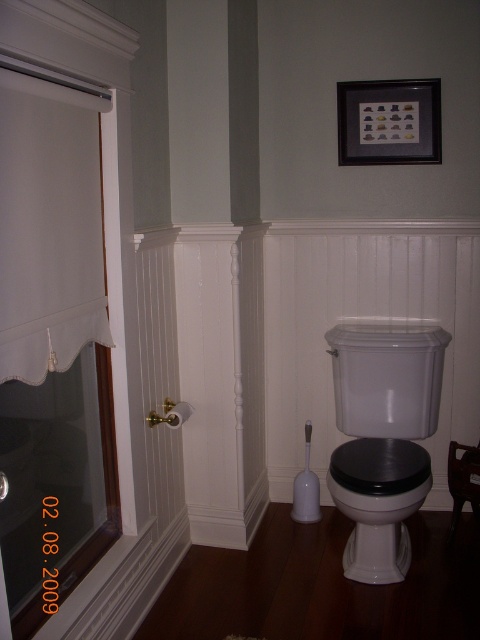
Question: Is white fabric curtain at left positioned in front of white glossy toilet at lower right?

Choices:
 (A) yes
 (B) no

Answer: (A)

Question: Which point is closer to the camera taking this photo?

Choices:
 (A) (367, 458)
 (B) (364, 456)
 (C) (50, 285)

Answer: (C)

Question: Is the position of white glossy toilet at center less distant than that of white glossy toilet at lower right?

Choices:
 (A) no
 (B) yes

Answer: (A)

Question: Among these objects, which one is nearest to the camera?

Choices:
 (A) white glossy toilet at center
 (B) white glossy toilet at lower right
 (C) white fabric curtain at left

Answer: (C)

Question: Is white glossy toilet at center further to camera compared to white glossy toilet at lower right?

Choices:
 (A) no
 (B) yes

Answer: (B)

Question: Among these points, which one is farthest from the camera?

Choices:
 (A) (67, 209)
 (B) (372, 556)

Answer: (B)